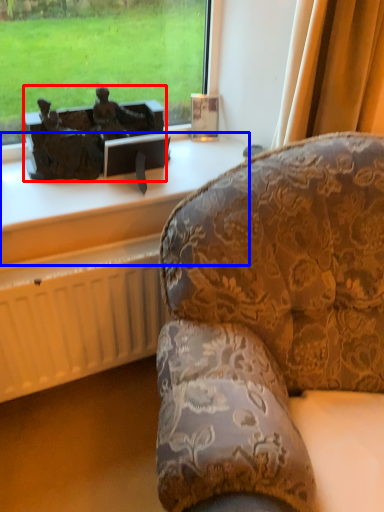
Question: Which point is closer to the camera, antique (highlighted by a red box) or furniture (highlighted by a blue box)?

Choices:
 (A) antique
 (B) furniture

Answer: (B)